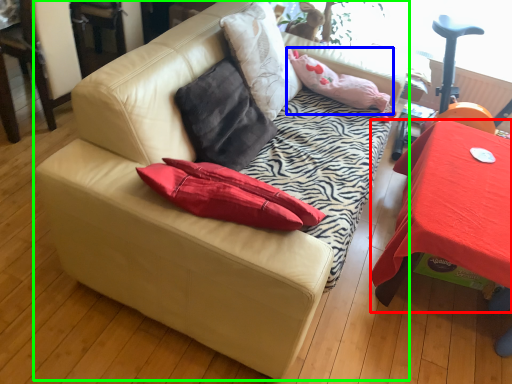
Question: Which object is positioned farthest from table (highlighted by a red box)? Select from pillow (highlighted by a blue box) and studio couch (highlighted by a green box).

Choices:
 (A) pillow
 (B) studio couch

Answer: (B)